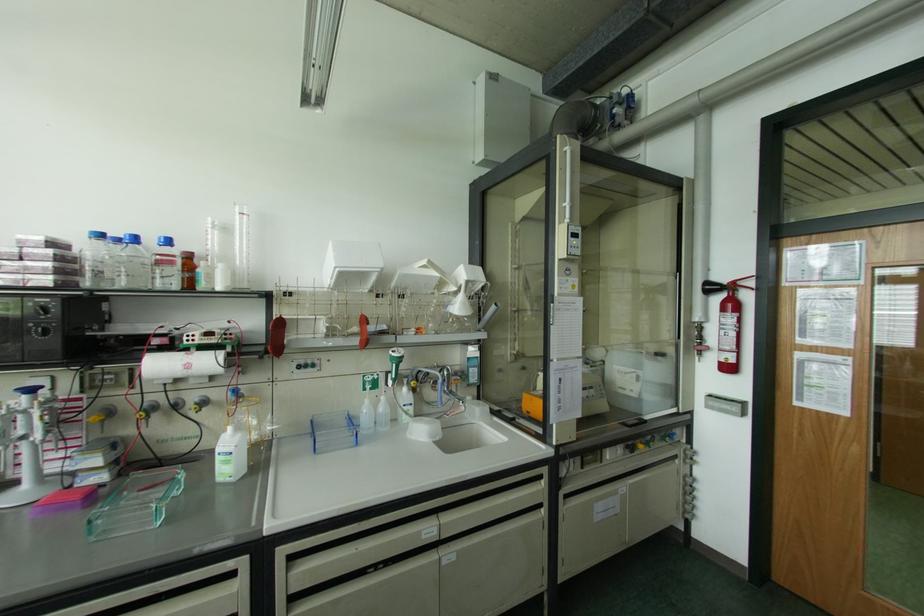
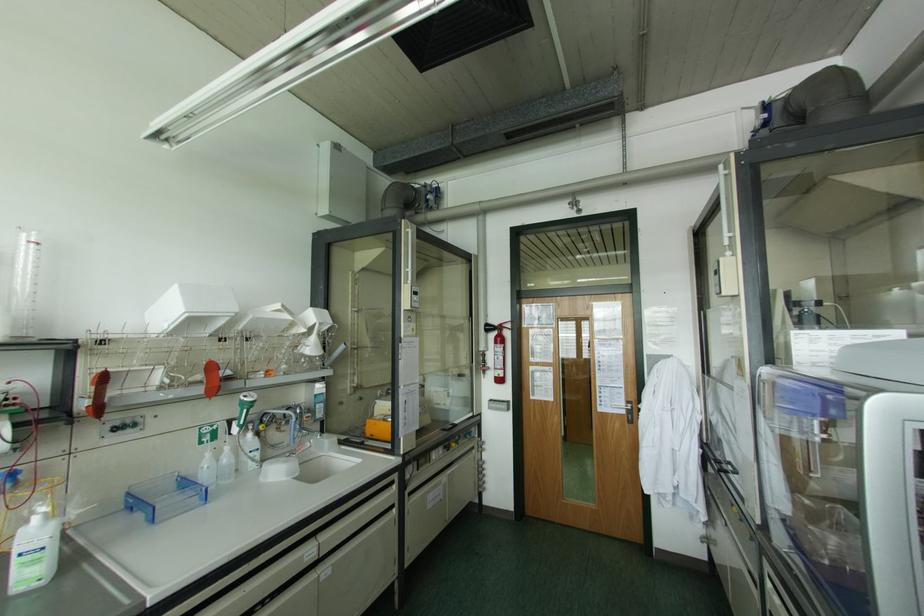
Find the pixel in the second image that matches point 238,435 in the first image.

(53, 523)